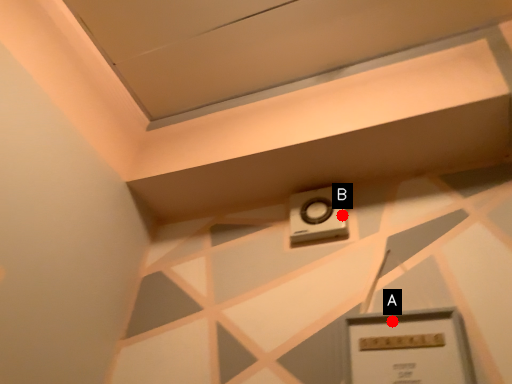
Question: Two points are circled on the image, labeled by A and B beside each circle. Which of the following is the farthest from the observer?

Choices:
 (A) A is further
 (B) B is further

Answer: (B)